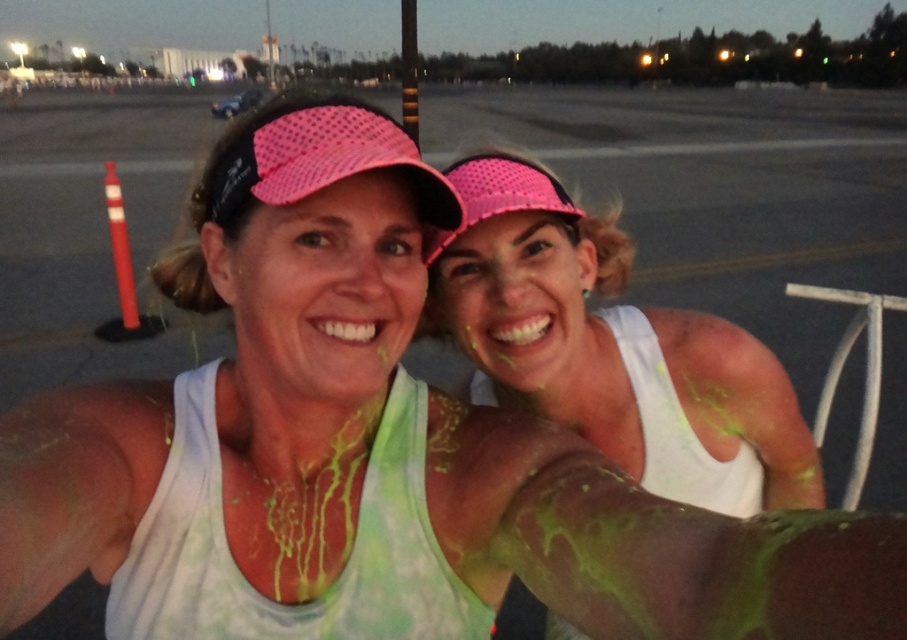
Question: Which point appears closest to the camera in this image?

Choices:
 (A) (362, 301)
 (B) (508, 330)
 (C) (652, 321)

Answer: (A)

Question: Is matte pink cap at center bigger than pink mesh cap at upper center?

Choices:
 (A) no
 (B) yes

Answer: (B)

Question: Does pink mesh visor at upper center appear on the right side of matte pink cap at center?

Choices:
 (A) yes
 (B) no

Answer: (A)

Question: Is pink mesh visor at upper center bigger than pink mesh cap at upper center?

Choices:
 (A) no
 (B) yes

Answer: (B)

Question: Which point appears farthest from the camera in this image?

Choices:
 (A) (544, 300)
 (B) (343, 355)

Answer: (A)

Question: Which is farther from the matte pink cap at center?

Choices:
 (A) pink mesh visor at upper center
 (B) pink mesh cap at upper center

Answer: (B)